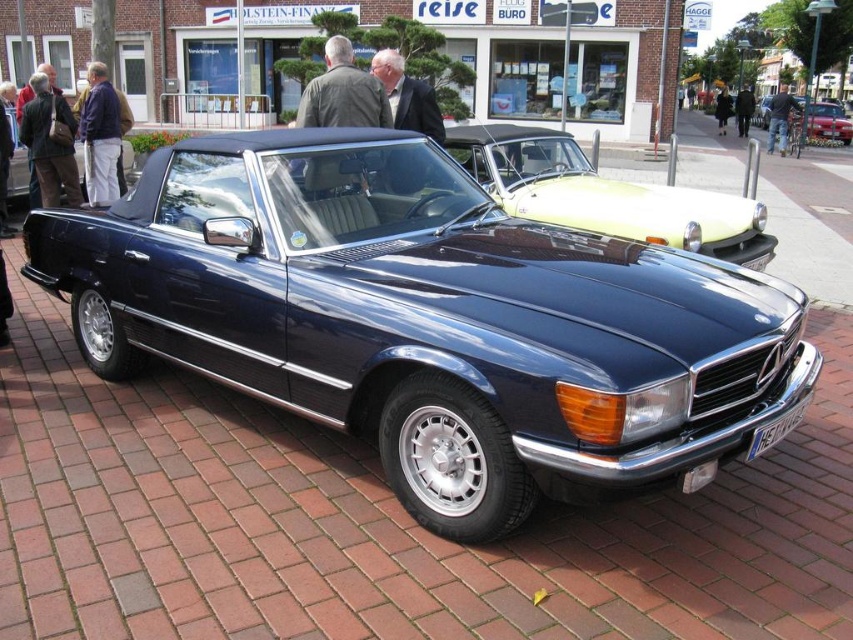
Question: Which object appears farthest from the camera in this image?

Choices:
 (A) dark brown leather jacket at left
 (B) blue jeans at left
 (C) white plastic license plate at lower center

Answer: (B)

Question: Does dark gray suit at center appear on the left side of blue jeans at left?

Choices:
 (A) yes
 (B) no

Answer: (B)

Question: Can you confirm if blue jeans at left is smaller than metallic silver convertible at center?

Choices:
 (A) no
 (B) yes

Answer: (B)

Question: Which point is farther to the camera?

Choices:
 (A) (772, 436)
 (B) (813, 115)
 (C) (747, 99)
 (D) (74, 204)

Answer: (C)

Question: Among these points, which one is farthest from the camera?

Choices:
 (A) (723, 106)
 (B) (798, 422)
 (C) (737, 102)
 (D) (791, 108)

Answer: (A)

Question: Can you confirm if dark gray suit at center is positioned below white plastic license plate at lower center?

Choices:
 (A) no
 (B) yes

Answer: (A)